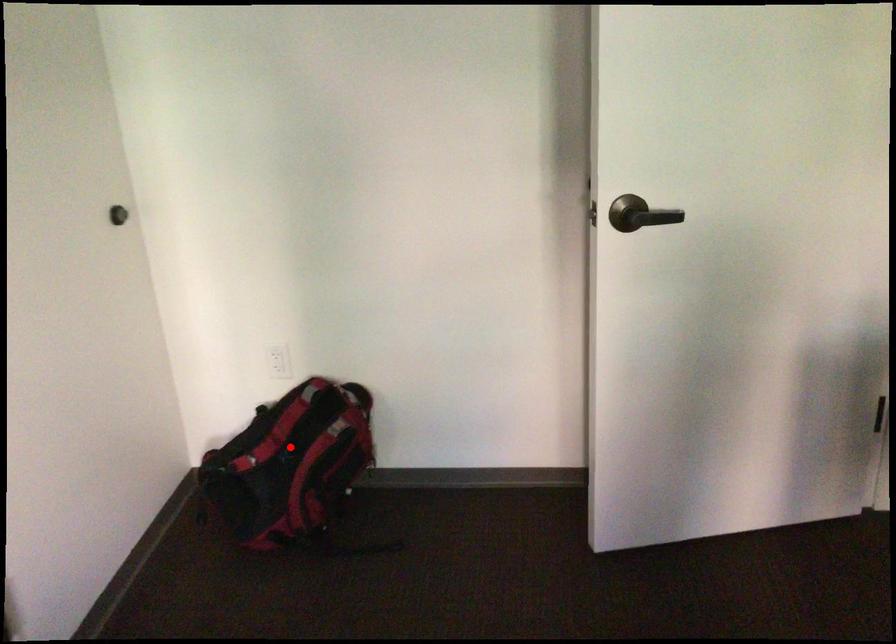
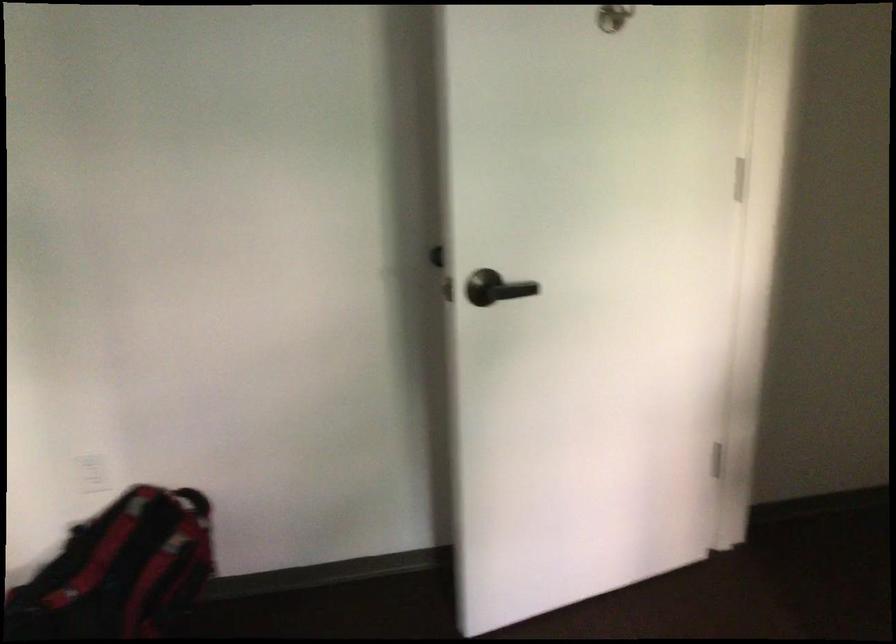
Question: A red point is marked in image1. In image2, is the corresponding 3D point closer to the camera or farther? Reply with the corresponding letter.

Choices:
 (A) The corresponding 3D point is closer.
 (B) The corresponding 3D point is farther.

Answer: (A)